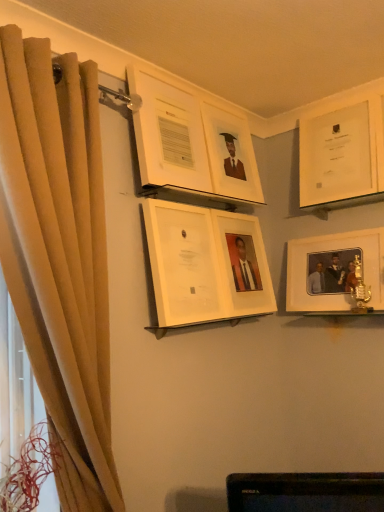
Question: Is white matte picture frame at right, marked as the 2th picture frame in a right-to-left arrangement, shorter than matte white picture frame at upper center, acting as the third picture frame starting from the left?

Choices:
 (A) yes
 (B) no

Answer: (A)

Question: Can you confirm if white matte picture frame at right, positioned as the fifth picture frame in left-to-right order, is bigger than matte white picture frame at upper center, acting as the third picture frame starting from the left?

Choices:
 (A) no
 (B) yes

Answer: (B)

Question: From a real-world perspective, is white matte picture frame at right, marked as the 2th picture frame in a right-to-left arrangement, over matte white picture frame at upper center, acting as the third picture frame starting from the left?

Choices:
 (A) yes
 (B) no

Answer: (B)

Question: From a real-world perspective, is white matte picture frame at right, positioned as the fifth picture frame in left-to-right order, under matte white picture frame at upper center, which ranks as the 4th picture frame in right-to-left order?

Choices:
 (A) yes
 (B) no

Answer: (A)

Question: Is white matte picture frame at right, positioned as the fifth picture frame in left-to-right order, wider than matte white picture frame at upper center, acting as the third picture frame starting from the left?

Choices:
 (A) yes
 (B) no

Answer: (A)

Question: From the image's perspective, is white matte picture frame at right, positioned as the fifth picture frame in left-to-right order, positioned above or below white matte picture frame at center, positioned as the fourth picture frame in left-to-right order?

Choices:
 (A) below
 (B) above

Answer: (A)

Question: Is white matte picture frame at right, marked as the 2th picture frame in a right-to-left arrangement, situated inside white matte picture frame at center, positioned as the fourth picture frame in left-to-right order, or outside?

Choices:
 (A) outside
 (B) inside

Answer: (A)

Question: Relative to white matte picture frame at center, the third picture frame in the right-to-left sequence, is white matte picture frame at right, marked as the 2th picture frame in a right-to-left arrangement, in front or behind?

Choices:
 (A) behind
 (B) front

Answer: (A)

Question: From a real-world perspective, relative to white matte picture frame at center, positioned as the fourth picture frame in left-to-right order, is white matte picture frame at right, positioned as the fifth picture frame in left-to-right order, vertically above or below?

Choices:
 (A) above
 (B) below

Answer: (B)

Question: Is beige fabric curtain at left inside or outside of white glossy picture frame at center, the second picture frame positioned from the left?

Choices:
 (A) inside
 (B) outside

Answer: (B)

Question: Looking at their shapes, would you say beige fabric curtain at left is wider or thinner than white glossy picture frame at center, the second picture frame positioned from the left?

Choices:
 (A) wide
 (B) thin

Answer: (A)

Question: Considering their positions, is beige fabric curtain at left located in front of or behind white glossy picture frame at center, which is the fifth picture frame in right-to-left order?

Choices:
 (A) front
 (B) behind

Answer: (A)

Question: Considering the positions of beige fabric curtain at left and white glossy picture frame at center, the second picture frame positioned from the left, in the image, is beige fabric curtain at left bigger or smaller than white glossy picture frame at center, the second picture frame positioned from the left,?

Choices:
 (A) small
 (B) big

Answer: (B)

Question: Considering their positions, is white matte picture frame at right, positioned as the fifth picture frame in left-to-right order, located in front of or behind beige fabric curtain at left?

Choices:
 (A) front
 (B) behind

Answer: (B)

Question: From a real-world perspective, is white matte picture frame at right, positioned as the fifth picture frame in left-to-right order, above or below beige fabric curtain at left?

Choices:
 (A) below
 (B) above

Answer: (B)